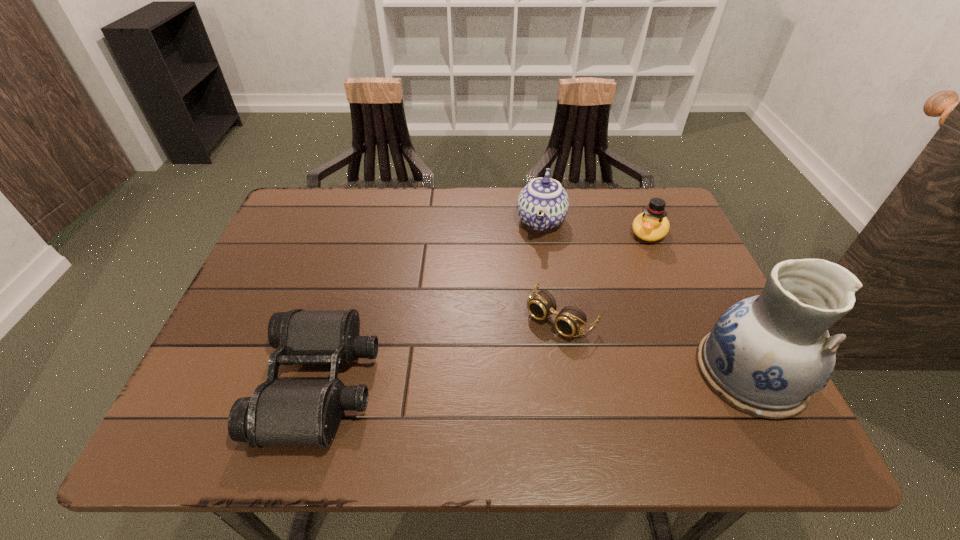
Find the location of `vacant space located from the spout of the chinaware`. vacant space located from the spout of the chinaware is located at coordinates (532, 275).

I want to click on vacant space located 0.330m on the front-facing side of the duck, so click(x=597, y=326).

Find the location of a particular element. free location located on the front-facing side of the duck is located at coordinates point(633,265).

What are the coordinates of `free space located on the front-facing side of the duck` in the screenshot? It's located at (601, 320).

Locate an element on the screen. The height and width of the screenshot is (540, 960). free space located 0.130m through the lenses of the shortest object is located at coordinates (504, 376).

Where is `blank area located through the lenses of the shortest object`? Image resolution: width=960 pixels, height=540 pixels. blank area located through the lenses of the shortest object is located at coordinates (498, 382).

The height and width of the screenshot is (540, 960). I want to click on vacant space located through the lenses of the shortest object, so click(486, 396).

Image resolution: width=960 pixels, height=540 pixels. What are the coordinates of `chinaware located at the far edge` in the screenshot? It's located at (543, 204).

In order to click on duck at the far edge in this screenshot , I will do `click(651, 225)`.

Where is `binoculars that is at the near edge`? Image resolution: width=960 pixels, height=540 pixels. binoculars that is at the near edge is located at coordinates (281, 412).